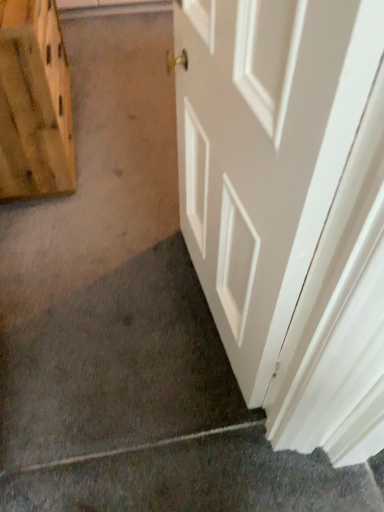
Find the location of a particular element. The image size is (384, 512). gray matte concrete at lower left is located at coordinates (194, 478).

This screenshot has height=512, width=384. What do you see at coordinates (34, 103) in the screenshot? I see `wooden plank at left` at bounding box center [34, 103].

What do you see at coordinates (265, 153) in the screenshot? I see `white glossy door at center` at bounding box center [265, 153].

I want to click on gray matte concrete at lower left, so click(x=194, y=478).

From the image's perspective, who appears lower, white glossy door at center or wooden plank at left?

white glossy door at center.

Is white glossy door at center situated inside wooden plank at left or outside?

white glossy door at center lies outside wooden plank at left.

What are the coordinates of `door above the gray matte concrete at lower left (from a real-world perspective)` in the screenshot? It's located at (265, 153).

Can you confirm if white glossy door at center is wider than gray matte concrete at lower left?

Yes.

Is white glossy door at center aimed at gray matte concrete at lower left?

No, white glossy door at center is not oriented towards gray matte concrete at lower left.

Does white glossy door at center come behind gray matte concrete at lower left?

No.

Is gray matte concrete at lower left shorter than wooden plank at left?

Yes.

Can you confirm if gray matte concrete at lower left is smaller than wooden plank at left?

Correct, gray matte concrete at lower left occupies less space than wooden plank at left.

This screenshot has height=512, width=384. Find the location of `concrete below the wooden plank at left (from the image's perspective)`. concrete below the wooden plank at left (from the image's perspective) is located at coordinates (194, 478).

Is wooden plank at left positioned before white glossy door at center?

No.

Considering the relative sizes of wooden plank at left and white glossy door at center in the image provided, is wooden plank at left thinner than white glossy door at center?

No.

From the image's perspective, would you say wooden plank at left is shown under white glossy door at center?

No.

From a real-world perspective, is wooden plank at left above or below white glossy door at center?

wooden plank at left is situated lower than white glossy door at center in the real world.

From a real-world perspective, is wooden plank at left positioned over gray matte concrete at lower left based on gravity?

Indeed, from a real-world perspective, wooden plank at left stands above gray matte concrete at lower left.

Is wooden plank at left positioned behind gray matte concrete at lower left?

That is True.

Who is taller, wooden plank at left or gray matte concrete at lower left?

wooden plank at left.

This screenshot has height=512, width=384. Find the location of `concrete in front of the wooden plank at left`. concrete in front of the wooden plank at left is located at coordinates (194, 478).

Would you consider gray matte concrete at lower left to be distant from white glossy door at center?

Actually, gray matte concrete at lower left and white glossy door at center are a little close together.

From the image's perspective, would you say gray matte concrete at lower left is positioned over white glossy door at center?

No.

Is gray matte concrete at lower left situated inside white glossy door at center or outside?

gray matte concrete at lower left is outside white glossy door at center.

Which is in front, gray matte concrete at lower left or white glossy door at center?

white glossy door at center is in front.

What are the coordinates of `door lying on the right of wooden plank at left` in the screenshot? It's located at (265, 153).

Identify the location of door above the gray matte concrete at lower left (from a real-world perspective). This screenshot has width=384, height=512. (265, 153).

When comparing their distances from white glossy door at center, does gray matte concrete at lower left or wooden plank at left seem further?

Based on the image, wooden plank at left appears to be further to white glossy door at center.

From the image, which object appears to be nearer to gray matte concrete at lower left, wooden plank at left or white glossy door at center?

The object closer to gray matte concrete at lower left is white glossy door at center.

From the image, which object appears to be nearer to white glossy door at center, wooden plank at left or gray matte concrete at lower left?

gray matte concrete at lower left is positioned closer to the anchor white glossy door at center.

Estimate the real-world distances between objects in this image. Which object is further from wooden plank at left, white glossy door at center or gray matte concrete at lower left?

Among the two, gray matte concrete at lower left is located further to wooden plank at left.

Considering their positions, is gray matte concrete at lower left positioned further to wooden plank at left than white glossy door at center?

gray matte concrete at lower left lies further to wooden plank at left than the other object.

From the image, which object appears to be nearer to gray matte concrete at lower left, white glossy door at center or wooden plank at left?

The object closer to gray matte concrete at lower left is white glossy door at center.

You are a GUI agent. You are given a task and a screenshot of the screen. Output one action in this format:
    pyautogui.click(x=<x>, y=<y>)
    Task: Click on the door between wooden plank at left and gray matte concrete at lower left in the up-down direction
    The image size is (384, 512).
    Given the screenshot: What is the action you would take?
    [x=265, y=153]